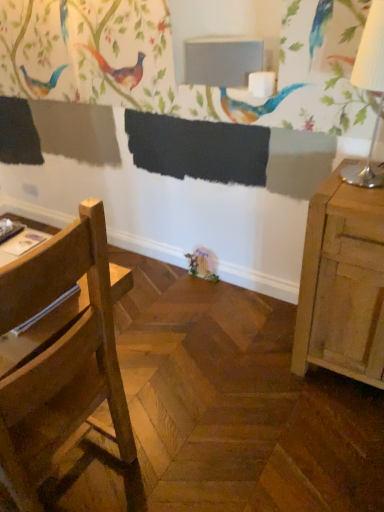
Question: Can you confirm if white paper lampshade at right is positioned to the right of matte gray table at upper center?

Choices:
 (A) yes
 (B) no

Answer: (A)

Question: Considering the relative sizes of white paper lampshade at right and matte gray table at upper center in the image provided, is white paper lampshade at right taller than matte gray table at upper center?

Choices:
 (A) yes
 (B) no

Answer: (A)

Question: Is white paper lampshade at right not within matte gray table at upper center?

Choices:
 (A) yes
 (B) no

Answer: (A)

Question: Does white paper lampshade at right turn towards matte gray table at upper center?

Choices:
 (A) yes
 (B) no

Answer: (B)

Question: Does white paper lampshade at right have a greater width compared to matte gray table at upper center?

Choices:
 (A) yes
 (B) no

Answer: (A)

Question: Do you think wooden chair at left is within white paper lampshade at right, or outside of it?

Choices:
 (A) inside
 (B) outside

Answer: (B)

Question: Considering the positions of wooden chair at left and white paper lampshade at right in the image, is wooden chair at left taller or shorter than white paper lampshade at right?

Choices:
 (A) short
 (B) tall

Answer: (B)

Question: From a real-world perspective, is wooden chair at left positioned above or below white paper lampshade at right?

Choices:
 (A) below
 (B) above

Answer: (A)

Question: Does point (29, 276) appear closer or farther from the camera than point (375, 53)?

Choices:
 (A) farther
 (B) closer

Answer: (B)

Question: Is wooden chair at left taller or shorter than matte gray table at upper center?

Choices:
 (A) short
 (B) tall

Answer: (B)

Question: In terms of size, does wooden chair at left appear bigger or smaller than matte gray table at upper center?

Choices:
 (A) small
 (B) big

Answer: (B)

Question: Do you think wooden chair at left is within matte gray table at upper center, or outside of it?

Choices:
 (A) outside
 (B) inside

Answer: (A)

Question: Considering the relative positions of wooden chair at left and matte gray table at upper center in the image provided, is wooden chair at left to the left or to the right of matte gray table at upper center?

Choices:
 (A) left
 (B) right

Answer: (A)

Question: Which is correct: white paper lampshade at right is inside matte gray table at upper center, or outside of it?

Choices:
 (A) inside
 (B) outside

Answer: (B)

Question: Looking at their shapes, would you say white paper lampshade at right is wider or thinner than matte gray table at upper center?

Choices:
 (A) thin
 (B) wide

Answer: (B)